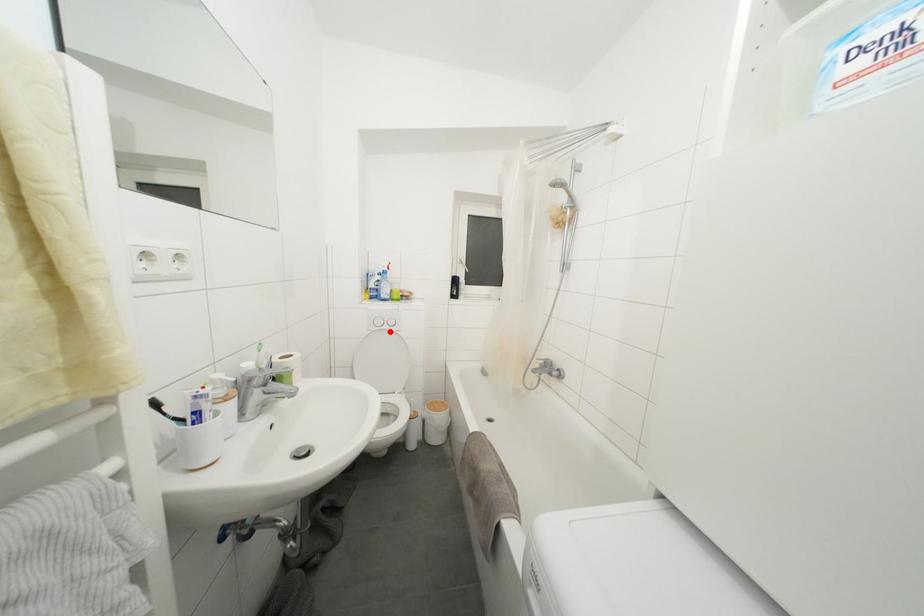
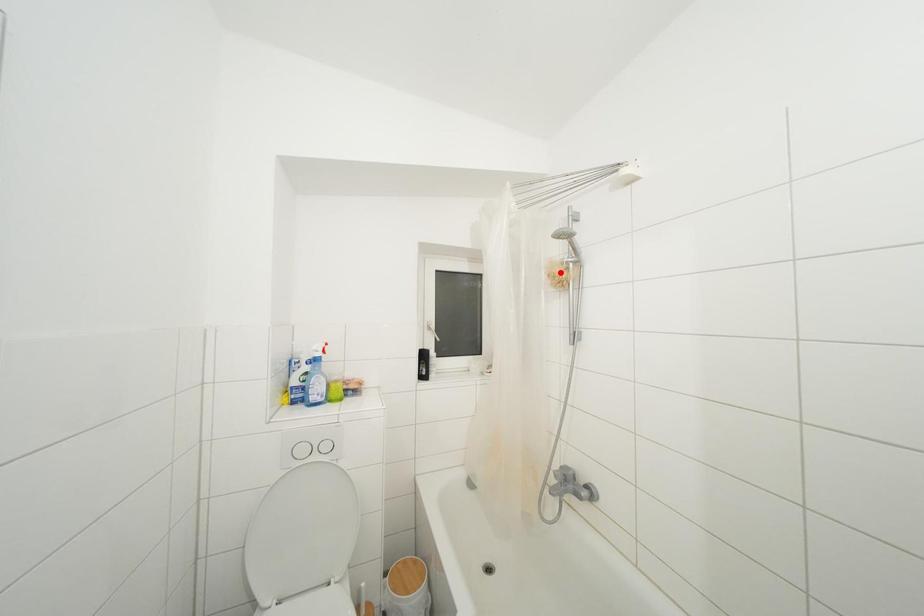
I am providing you with two images of the same scene from different viewpoints. A red point is marked on the first image and another point is marked on the second image. Is the red point in image1 aligned with the point shown in image2?

No